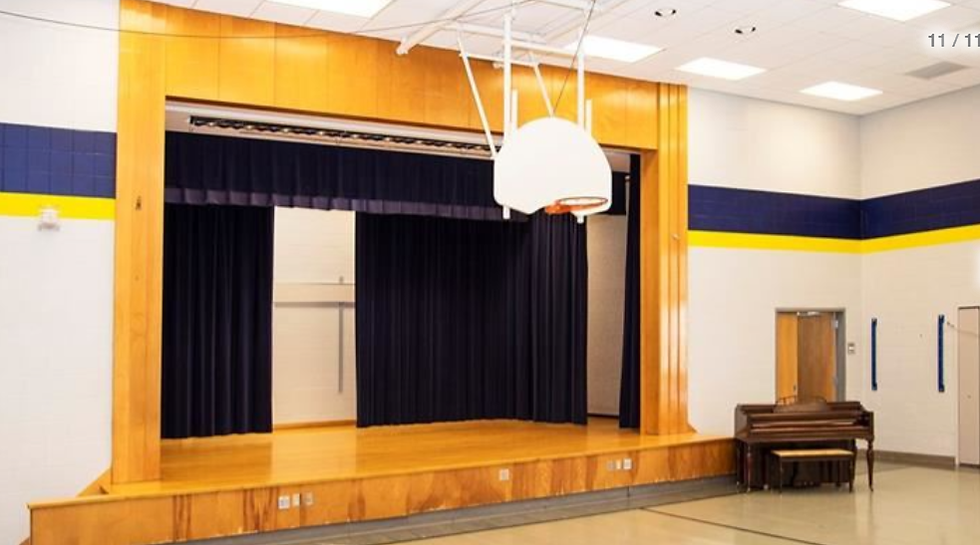
I want to click on white walls, so click(36, 312), click(725, 293).